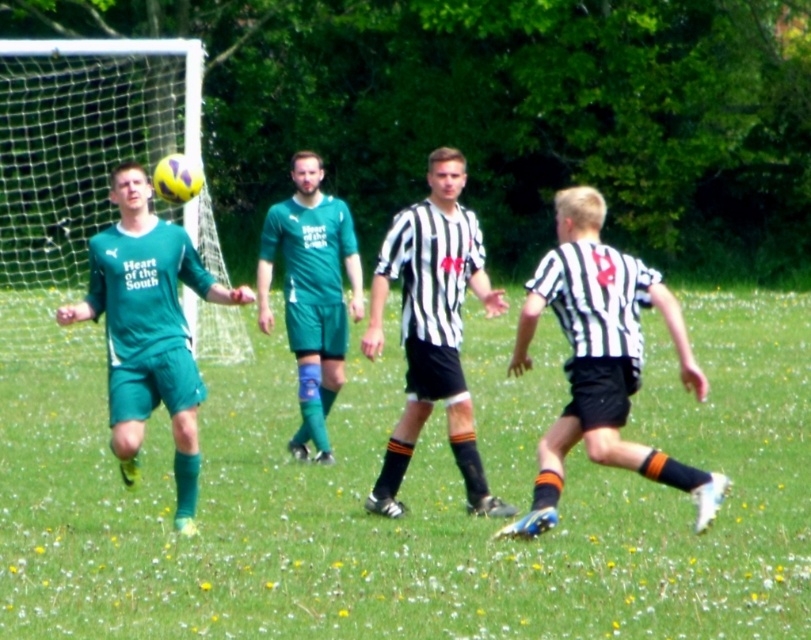
Who is more distant from viewer, (376, 323) or (320, 157)?

The point (320, 157) is more distant.

Is black and white striped shirt at center taller than green matte uniform at center?

Yes, black and white striped shirt at center is taller than green matte uniform at center.

Find the location of a particular element. black and white striped shirt at center is located at coordinates (432, 326).

Does green grass at center have a lesser height compared to green matte soccer jersey at left?

No, green grass at center is not shorter than green matte soccer jersey at left.

Can you confirm if green grass at center is positioned below green matte soccer jersey at left?

Yes, green grass at center is below green matte soccer jersey at left.

Does point (805, 371) come behind point (110, 182)?

No, (805, 371) is in front of (110, 182).

Where is `green grass at center`? green grass at center is located at coordinates (413, 508).

Is green grass at center in front of black and white striped shirt at center?

Yes, it is in front of black and white striped shirt at center.

You are a GUI agent. You are given a task and a screenshot of the screen. Output one action in this format:
    pyautogui.click(x=<x>, y=<y>)
    Task: Click on the green grass at center
    The width and height of the screenshot is (811, 640).
    Given the screenshot: What is the action you would take?
    pyautogui.click(x=413, y=508)